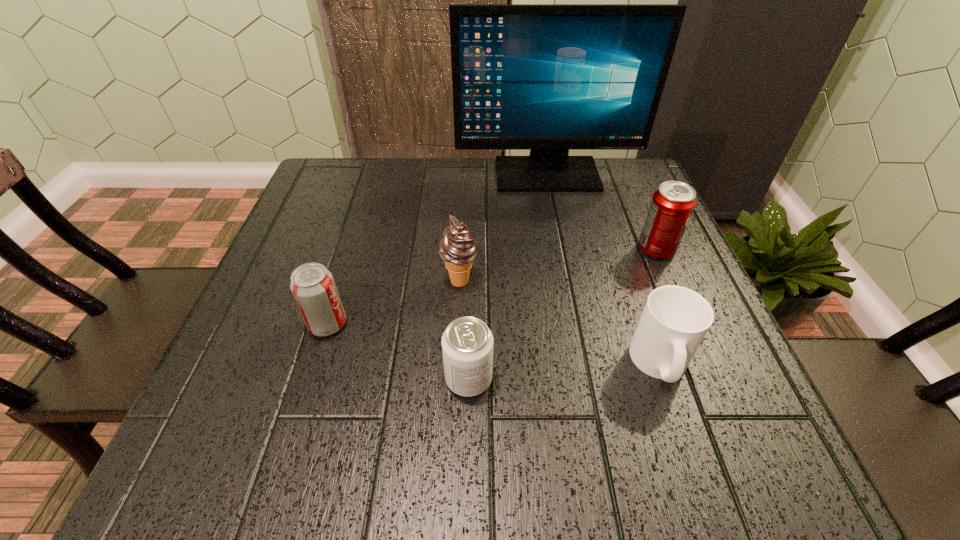
At what (x,y) coordinates should I click in order to perform the action: click on free point located on the front of the third farthest object. Please return your answer as a coordinate pair (x, y). Looking at the image, I should click on (452, 447).

Find the location of `vacant space located on the left of the tallest soda can`. vacant space located on the left of the tallest soda can is located at coordinates (515, 249).

Where is `free space located 0.210m on the front of the leftmost object`? Image resolution: width=960 pixels, height=540 pixels. free space located 0.210m on the front of the leftmost object is located at coordinates (287, 455).

Find the location of a particular element. The image size is (960, 540). vacant space located 0.100m on the handle side of the mug is located at coordinates (694, 460).

What are the coordinates of `free region located on the back of the second soda can from right to left` in the screenshot? It's located at (471, 267).

Locate an element on the screen. object that is at the far edge is located at coordinates (548, 78).

I want to click on object positioned at the left edge, so click(x=312, y=285).

Identify the location of monitor present at the right edge. Image resolution: width=960 pixels, height=540 pixels. (548, 78).

Find the location of a particular element. The width and height of the screenshot is (960, 540). soda can present at the right edge is located at coordinates (672, 204).

Locate an element on the screen. Image resolution: width=960 pixels, height=540 pixels. mug that is at the right edge is located at coordinates (675, 320).